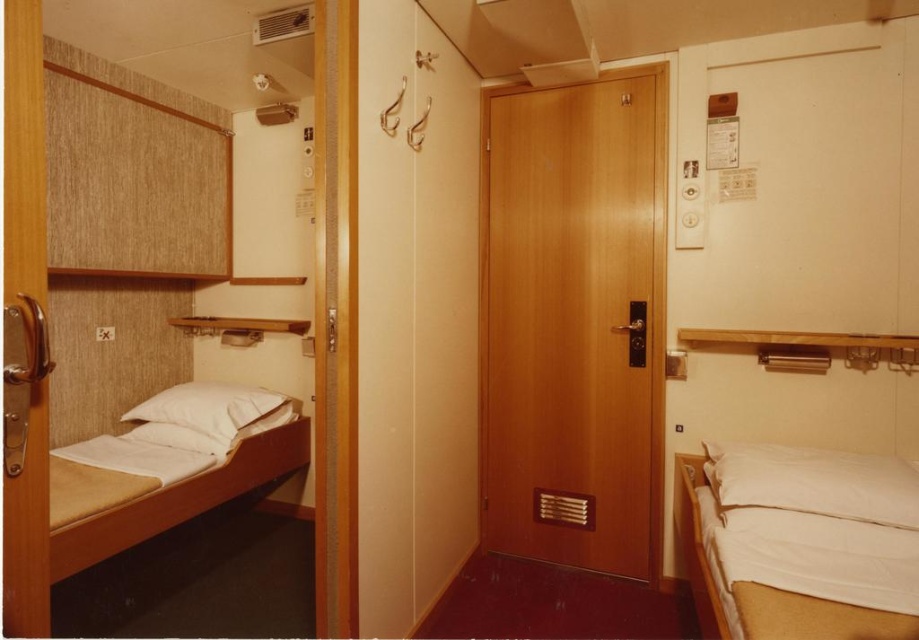
Question: Considering the relative positions of white matte bed at right and white soft pillow at right in the image provided, where is white matte bed at right located with respect to white soft pillow at right?

Choices:
 (A) left
 (B) right

Answer: (A)

Question: Which of the following is the farthest from the observer?

Choices:
 (A) white matte bed at right
 (B) white soft pillow at right

Answer: (B)

Question: Among these objects, which one is farthest from the camera?

Choices:
 (A) white matte bed at right
 (B) white matte bed at left
 (C) white soft pillow at right

Answer: (B)

Question: Considering the real-world distances, which object is farthest from the white matte bed at left?

Choices:
 (A) white matte bed at right
 (B) white soft pillow at left

Answer: (A)

Question: Does white matte bed at right appear over white soft pillow at left?

Choices:
 (A) yes
 (B) no

Answer: (B)

Question: Does white soft pillow at right appear on the right side of white soft pillow at left?

Choices:
 (A) no
 (B) yes

Answer: (B)